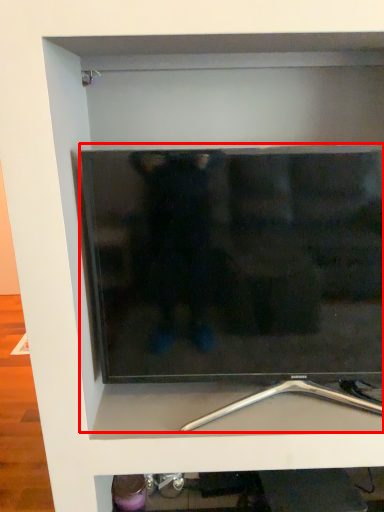
Question: From the image's perspective, where is television (annotated by the red box) located relative to silver?

Choices:
 (A) below
 (B) above

Answer: (B)